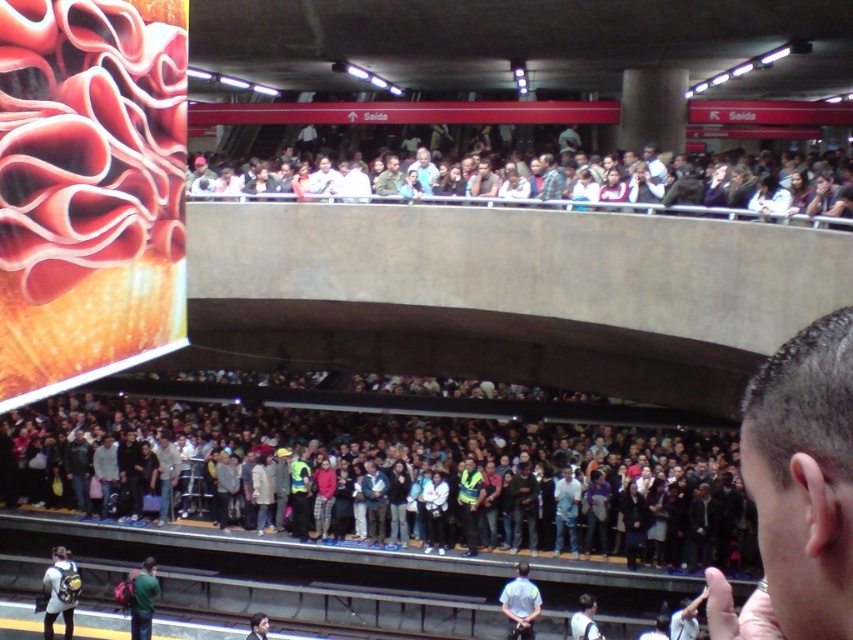
Which of these two, dark gray shirt at upper center or light blue shirt at upper center, stands taller?

Standing taller between the two is light blue shirt at upper center.

Who is positioned more to the right, dark gray shirt at upper center or light blue shirt at upper center?

Positioned to the right is dark gray shirt at upper center.

What do you see at coordinates (548, 179) in the screenshot?
I see `dark gray shirt at upper center` at bounding box center [548, 179].

Find the location of a particular element. This screenshot has height=640, width=853. dark gray shirt at upper center is located at coordinates (548, 179).

Which is more to the right, multicolored casual clothing at upper center or red flannel shirt at lower center?

multicolored casual clothing at upper center

Does multicolored casual clothing at upper center come behind red flannel shirt at lower center?

That is False.

Who is more distant from viewer, (465, 195) or (332, 472)?

The point (465, 195) is more distant.

Where is `multicolored casual clothing at upper center`? This screenshot has height=640, width=853. multicolored casual clothing at upper center is located at coordinates (585, 189).

From the picture: Does light blue uniform at lower center have a smaller size compared to light blue shirt at upper center?

Correct, light blue uniform at lower center occupies less space than light blue shirt at upper center.

Is light blue uniform at lower center bigger than light blue shirt at upper center?

No.

Is point (512, 602) less distant than point (419, 168)?

Yes, point (512, 602) is in front of point (419, 168).

Locate an element on the screen. This screenshot has width=853, height=640. light blue uniform at lower center is located at coordinates (520, 604).